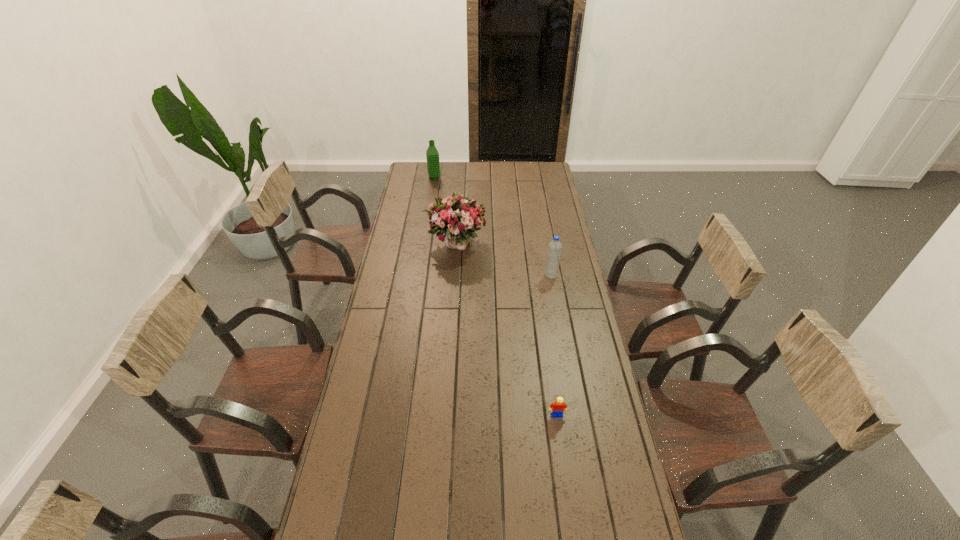
Where is `free spot at the far right corner of the desktop`? The image size is (960, 540). free spot at the far right corner of the desktop is located at coordinates (545, 167).

This screenshot has height=540, width=960. In order to click on vacant space in between the third farthest object and the left water bottle in this screenshot , I will do `click(492, 226)`.

Where is `free space between the rightmost object and the nearest object`? free space between the rightmost object and the nearest object is located at coordinates (554, 345).

Find the location of a particular element. empty space between the nearer water bottle and the left water bottle is located at coordinates (492, 226).

Find the location of a particular element. The height and width of the screenshot is (540, 960). empty location between the nearest object and the bouquet is located at coordinates (506, 329).

Image resolution: width=960 pixels, height=540 pixels. I want to click on free spot between the bouquet and the nearer water bottle, so click(x=503, y=260).

The image size is (960, 540). In order to click on blank region between the third object from left to right and the nearer water bottle in this screenshot , I will do `click(554, 345)`.

Identify the location of free space between the Lego and the farther water bottle. The width and height of the screenshot is (960, 540). (495, 296).

Where is `unoccupied area between the bouquet and the second nearest object`? The width and height of the screenshot is (960, 540). unoccupied area between the bouquet and the second nearest object is located at coordinates (503, 260).

Where is `vacant area that lies between the nearer water bottle and the Lego`? The width and height of the screenshot is (960, 540). vacant area that lies between the nearer water bottle and the Lego is located at coordinates (554, 345).